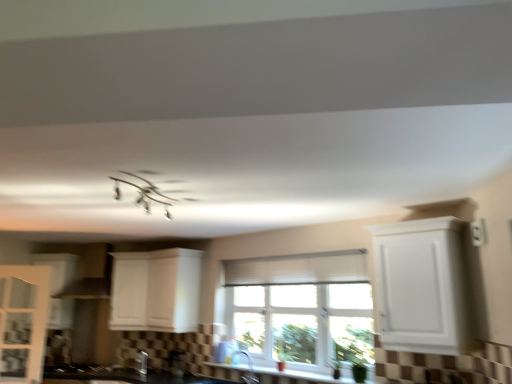
At what (x,y) coordinates should I click in order to perform the action: click on free point in front of satin silver toaster at lower center, the 2th appliance from the right. Please return your answer as a coordinate pair (x, y). This screenshot has width=512, height=384. Looking at the image, I should click on (137, 377).